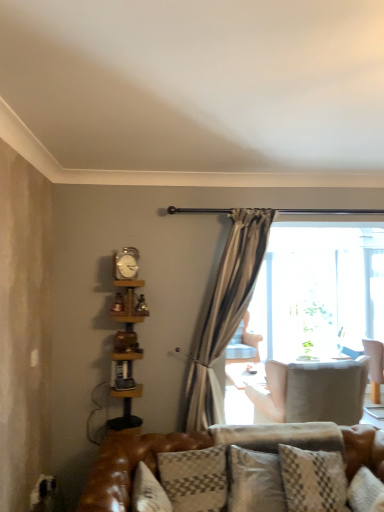
Question: Does velvet beige chair at center, positioned as the 3th chair in right-to-left order, appear on the left side of metallic silver clock at upper center?

Choices:
 (A) no
 (B) yes

Answer: (A)

Question: Is the position of velvet beige chair at center, the 1th chair viewed from the back, more distant than that of metallic silver clock at upper center?

Choices:
 (A) no
 (B) yes

Answer: (B)

Question: Is velvet beige chair at center, positioned as the 3th chair in right-to-left order, outside of metallic silver clock at upper center?

Choices:
 (A) no
 (B) yes

Answer: (B)

Question: Can you confirm if velvet beige chair at center, the 1th chair from the left, is shorter than metallic silver clock at upper center?

Choices:
 (A) yes
 (B) no

Answer: (B)

Question: Can you confirm if velvet beige chair at center, positioned as the 3th chair in right-to-left order, is bigger than metallic silver clock at upper center?

Choices:
 (A) yes
 (B) no

Answer: (A)

Question: Considering the relative sizes of velvet beige chair at center, the 3th chair when ordered from front to back, and metallic silver clock at upper center in the image provided, is velvet beige chair at center, the 3th chair when ordered from front to back, taller than metallic silver clock at upper center?

Choices:
 (A) yes
 (B) no

Answer: (A)

Question: Is plush gray pillow at center, the first pillow when ordered from back to front, at the right side of wooden bookshelf at left?

Choices:
 (A) yes
 (B) no

Answer: (A)

Question: From the image's perspective, is plush gray pillow at center, positioned as the second pillow in left-to-right order, over wooden bookshelf at left?

Choices:
 (A) yes
 (B) no

Answer: (B)

Question: Is plush gray pillow at center, positioned as the second pillow in left-to-right order, in contact with wooden bookshelf at left?

Choices:
 (A) yes
 (B) no

Answer: (B)

Question: Is plush gray pillow at center, the first pillow when ordered from back to front, positioned with its back to wooden bookshelf at left?

Choices:
 (A) no
 (B) yes

Answer: (A)

Question: From a real-world perspective, is plush gray pillow at center, the first pillow when ordered from back to front, beneath wooden bookshelf at left?

Choices:
 (A) yes
 (B) no

Answer: (A)

Question: Considering the relative sizes of plush gray pillow at center, positioned as the second pillow in left-to-right order, and wooden bookshelf at left in the image provided, is plush gray pillow at center, positioned as the second pillow in left-to-right order, shorter than wooden bookshelf at left?

Choices:
 (A) yes
 (B) no

Answer: (A)

Question: From a real-world perspective, does metallic silver clock at upper center sit lower than wooden bookshelf at left?

Choices:
 (A) no
 (B) yes

Answer: (A)